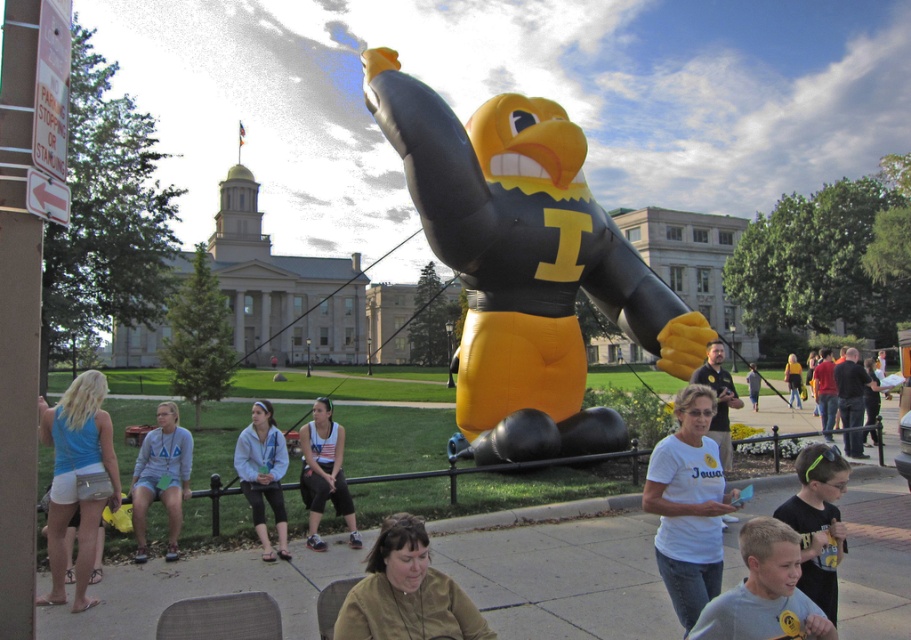
Question: Does white tank top at center appear over yellow shirt at center?

Choices:
 (A) yes
 (B) no

Answer: (A)

Question: Does yellow matte inflatable at center have a greater width compared to neon green headband at lower right?

Choices:
 (A) no
 (B) yes

Answer: (A)

Question: Which object is closer to the camera taking this photo?

Choices:
 (A) white tank top at center
 (B) gray cotton shirt at lower right

Answer: (B)

Question: Which object is closer to the camera taking this photo?

Choices:
 (A) yellow shirt at center
 (B) matte blue tank top at left

Answer: (B)

Question: Is yellow matte inflatable at center further to the viewer compared to neon green headband at lower right?

Choices:
 (A) no
 (B) yes

Answer: (B)

Question: Which point is farther to the camera?

Choices:
 (A) white tank top at center
 (B) matte black shirt at lower right

Answer: (B)